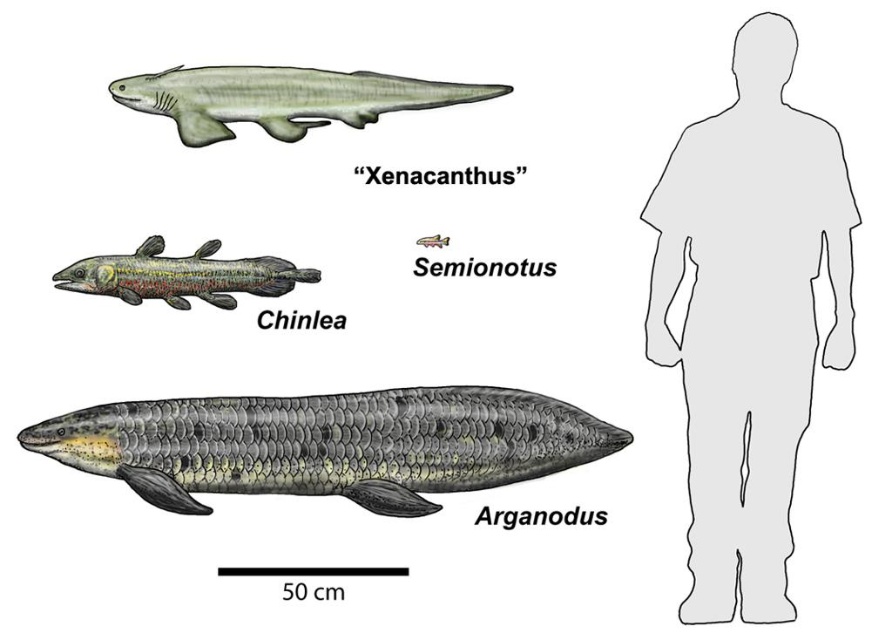
Does greenish-gray scaly xenacanthus at upper center appear over shiny greenish-blue fish at center?

Yes.

Is point (253, 109) in front of point (271, 276)?

Yes, point (253, 109) is in front of point (271, 276).

Who is more forward, (333, 112) or (78, 269)?

Point (78, 269)

Image resolution: width=892 pixels, height=640 pixels. I want to click on greenish-gray scaly xenacanthus at upper center, so click(x=281, y=99).

The image size is (892, 640). What are the coordinates of `silhouette figure at center` in the screenshot? It's located at (749, 316).

Is point (775, 612) closer to camera compared to point (410, 90)?

Yes, point (775, 612) is closer to viewer.

Between point (760, 292) and point (212, 97), which one is positioned in front?

Point (760, 292) is in front.

This screenshot has width=892, height=640. In order to click on silhouette figure at center in this screenshot , I will do `click(749, 316)`.

Is point (95, 467) farther from camera compared to point (434, 240)?

No, it is in front of (434, 240).

Does shiny metallic fish at center have a lesser width compared to shiny silver fish at upper center?

No, shiny metallic fish at center is not thinner than shiny silver fish at upper center.

You are a GUI agent. You are given a task and a screenshot of the screen. Output one action in this format:
    pyautogui.click(x=<x>, y=<y>)
    Task: Click on the shiny metallic fish at center
    The height and width of the screenshot is (640, 892).
    Given the screenshot: What is the action you would take?
    pyautogui.click(x=327, y=444)